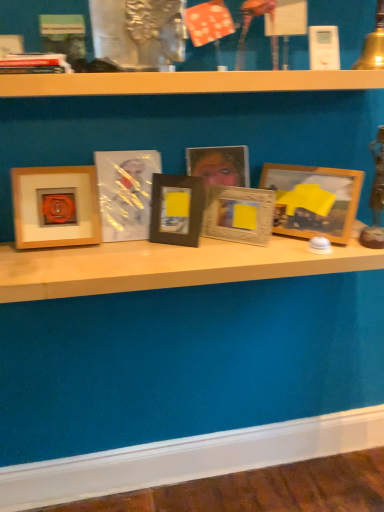
Image resolution: width=384 pixels, height=512 pixels. I want to click on black matte picture frame at center, which ranks as the third picture frame in left-to-right order, so click(x=176, y=209).

The width and height of the screenshot is (384, 512). What do you see at coordinates (176, 209) in the screenshot?
I see `black matte picture frame at center, which is the 4th picture frame in right-to-left order` at bounding box center [176, 209].

Identify the location of hardcover book at upper left. The image size is (384, 512). (34, 64).

This screenshot has height=512, width=384. What are the coordinates of `wooden shelf at upper center` in the screenshot? It's located at (186, 82).

In order to face wooden shelf at upper center, should I rotate leftwards or rightwards?

To face it directly, rotate right by 1.741 degrees.

You are a GUI agent. You are given a task and a screenshot of the screen. Output one action in this format:
    pyautogui.click(x=<x>, y=<y>)
    Task: Click on the wooden shelf at center
    The height and width of the screenshot is (512, 384).
    Given the screenshot: What is the action you would take?
    168,266

Image resolution: width=384 pixels, height=512 pixels. What do you see at coordinates (55, 207) in the screenshot? I see `matte wood picture frame at left, the sixth picture frame when ordered from right to left` at bounding box center [55, 207].

You are a GUI agent. You are given a task and a screenshot of the screen. Output one action in this format:
    pyautogui.click(x=<x>, y=<y>)
    Task: Click on the black matte picture frame at center, which ranks as the third picture frame in left-to-right order
    
    Given the screenshot: What is the action you would take?
    pyautogui.click(x=176, y=209)

Does matte wood picture frame at left, the sixth picture frame when ordered from right to left, have a greater width compared to hardcover book at upper left?

In fact, matte wood picture frame at left, the sixth picture frame when ordered from right to left, might be narrower than hardcover book at upper left.

Based on their sizes in the image, would you say matte wood picture frame at left, the sixth picture frame when ordered from right to left, is bigger or smaller than hardcover book at upper left?

In the image, matte wood picture frame at left, the sixth picture frame when ordered from right to left, appears to be larger than hardcover book at upper left.

Does matte wood picture frame at left, marked as the first picture frame in a left-to-right arrangement, lie behind hardcover book at upper left?

Yes, the depth of matte wood picture frame at left, marked as the first picture frame in a left-to-right arrangement, is greater than that of hardcover book at upper left.

Which object is positioned more to the left, matte wood picture frame at left, marked as the first picture frame in a left-to-right arrangement, or hardcover book at upper left?

hardcover book at upper left.

In terms of width, does matte plastic picture frame at center, the fifth picture frame from the right, look wider or thinner when compared to wooden shelf at center?

Clearly, matte plastic picture frame at center, the fifth picture frame from the right, has less width compared to wooden shelf at center.

Considering the positions of point (113, 188) and point (157, 259), is point (113, 188) closer or farther from the camera than point (157, 259)?

Point (113, 188) is positioned farther from the camera compared to point (157, 259).

From a real-world perspective, between matte plastic picture frame at center, marked as the 2th picture frame in a left-to-right arrangement, and wooden shelf at center, who is vertically higher?

matte plastic picture frame at center, marked as the 2th picture frame in a left-to-right arrangement, is physically above.

Is matte plastic picture frame at center, the fifth picture frame from the right, situated inside wooden shelf at center or outside?

matte plastic picture frame at center, the fifth picture frame from the right, is spatially situated outside wooden shelf at center.

Is matte plastic picture frame at center, marked as the 2th picture frame in a left-to-right arrangement, directly adjacent to wooden photo frame at center, acting as the fourth picture frame starting from the left?

matte plastic picture frame at center, marked as the 2th picture frame in a left-to-right arrangement, is not next to wooden photo frame at center, acting as the fourth picture frame starting from the left, and they're not touching.

Who is more distant, matte plastic picture frame at center, marked as the 2th picture frame in a left-to-right arrangement, or wooden photo frame at center, acting as the fourth picture frame starting from the left?

Positioned behind is wooden photo frame at center, acting as the fourth picture frame starting from the left.

Measure the distance between matte plastic picture frame at center, marked as the 2th picture frame in a left-to-right arrangement, and wooden photo frame at center, the 3th picture frame in the right-to-left sequence.

matte plastic picture frame at center, marked as the 2th picture frame in a left-to-right arrangement, is 23.09 centimeters from wooden photo frame at center, the 3th picture frame in the right-to-left sequence.

From the image's perspective, does matte plastic picture frame at center, marked as the 2th picture frame in a left-to-right arrangement, appear lower than wooden photo frame at center, acting as the fourth picture frame starting from the left?

Correct, matte plastic picture frame at center, marked as the 2th picture frame in a left-to-right arrangement, appears lower than wooden photo frame at center, acting as the fourth picture frame starting from the left, in the image.

Is wooden shelf at center positioned far away from wooden picture frame at center, the 2th picture frame when ordered from right to left?

No, wooden shelf at center is in close proximity to wooden picture frame at center, the 2th picture frame when ordered from right to left.

From a real-world perspective, who is located lower, wooden shelf at center or wooden picture frame at center, the 2th picture frame when ordered from right to left?

wooden shelf at center is physically lower.

Looking at this image, can you tell me how much wooden shelf at center and wooden picture frame at center, the fifth picture frame from the left, differ in facing direction?

The facing directions of wooden shelf at center and wooden picture frame at center, the fifth picture frame from the left, are 37 degrees apart.

Which object is positioned more to the right, wooden shelf at center or wooden picture frame at center, the 2th picture frame when ordered from right to left?

From the viewer's perspective, wooden picture frame at center, the 2th picture frame when ordered from right to left, appears more on the right side.

From a real-world perspective, is hardcover book at upper left positioned above or below wooden shelf at upper center?

Clearly, from a real-world perspective, hardcover book at upper left is above wooden shelf at upper center.

Is hardcover book at upper left to the left or to the right of wooden shelf at upper center in the image?

From the image, it's evident that hardcover book at upper left is to the left of wooden shelf at upper center.

Is hardcover book at upper left taller or shorter than wooden shelf at upper center?

Considering their sizes, hardcover book at upper left has less height than wooden shelf at upper center.

How different are the orientations of hardcover book at upper left and wooden shelf at upper center in degrees?

The angle between the facing direction of hardcover book at upper left and the facing direction of wooden shelf at upper center is 4.75 degrees.

Is wooden picture frame at center, the fifth picture frame from the left, wider or thinner than hardcover book at upper left?

In the image, wooden picture frame at center, the fifth picture frame from the left, appears to be more narrow than hardcover book at upper left.

Is wooden picture frame at center, the 2th picture frame when ordered from right to left, in contact with hardcover book at upper left?

wooden picture frame at center, the 2th picture frame when ordered from right to left, is not next to hardcover book at upper left, and they're not touching.

Which point is more distant from viewer, (251, 207) or (9, 68)?

Positioned behind is point (251, 207).

Is wooden picture frame at center, the 2th picture frame when ordered from right to left, further to camera compared to hardcover book at upper left?

Yes, it is.

How different are the orientations of matte plastic picture frame at center, the fifth picture frame from the right, and wooden picture frame at center, the fifth picture frame from the left, in degrees?

36.2 degrees.

In the scene shown: In terms of width, does matte plastic picture frame at center, the fifth picture frame from the right, look wider or thinner when compared to wooden picture frame at center, the 2th picture frame when ordered from right to left?

In the image, matte plastic picture frame at center, the fifth picture frame from the right, appears to be wider than wooden picture frame at center, the 2th picture frame when ordered from right to left.

Could wooden picture frame at center, the fifth picture frame from the left, be considered to be inside matte plastic picture frame at center, the fifth picture frame from the right?

No, wooden picture frame at center, the fifth picture frame from the left, is located outside of matte plastic picture frame at center, the fifth picture frame from the right.

Could you tell me if matte plastic picture frame at center, marked as the 2th picture frame in a left-to-right arrangement, is turned towards wooden picture frame at center, the fifth picture frame from the left?

No, matte plastic picture frame at center, marked as the 2th picture frame in a left-to-right arrangement, is not aimed at wooden picture frame at center, the fifth picture frame from the left.

Which picture frame is the 1st one when counting from the right side of the hardcover book at upper left? Please provide its 2D coordinates.

[(55, 207)]

Where is `picture frame that is the 5th one when counting upward from the wooden shelf at center (from the image's perspective)`? Image resolution: width=384 pixels, height=512 pixels. picture frame that is the 5th one when counting upward from the wooden shelf at center (from the image's perspective) is located at coordinates coord(126,192).

Estimate the real-world distances between objects in this image. Which object is closer to wooden shelf at upper center, hardcover book at upper left or wooden shelf at center?

hardcover book at upper left.

When comparing their distances from wooden picture frame at center, the 2th picture frame when ordered from right to left, does black matte picture frame at center, which ranks as the third picture frame in left-to-right order, or wooden photo frame at center, the 3th picture frame in the right-to-left sequence, seem closer?

Among the two, black matte picture frame at center, which ranks as the third picture frame in left-to-right order, is located nearer to wooden picture frame at center, the 2th picture frame when ordered from right to left.

Considering their positions, is hardcover book at upper left positioned closer to matte plastic picture frame at center, marked as the 2th picture frame in a left-to-right arrangement, than wooden picture frame at center, the 2th picture frame when ordered from right to left?

wooden picture frame at center, the 2th picture frame when ordered from right to left, lies closer to matte plastic picture frame at center, marked as the 2th picture frame in a left-to-right arrangement, than the other object.

Considering their positions, is wooden photo frame at center, the 3th picture frame in the right-to-left sequence, positioned further to wooden shelf at upper center than hardcover book at upper left?

wooden photo frame at center, the 3th picture frame in the right-to-left sequence, is positioned further to the anchor wooden shelf at upper center.

Which object lies further to the anchor point wooden shelf at upper center, black matte picture frame at center, which ranks as the third picture frame in left-to-right order, or wooden shelf at center?

Among the two, wooden shelf at center is located further to wooden shelf at upper center.

Which object lies nearer to the anchor point black matte picture frame at center, which ranks as the third picture frame in left-to-right order, wooden shelf at upper center or wooden picture frame at center, the 2th picture frame when ordered from right to left?

Based on the image, wooden picture frame at center, the 2th picture frame when ordered from right to left, appears to be nearer to black matte picture frame at center, which ranks as the third picture frame in left-to-right order.

Consider the image. Based on their spatial positions, is hardcover book at upper left or wooden shelf at upper center further from black matte picture frame at center, which is the 4th picture frame in right-to-left order?

hardcover book at upper left.

Which object lies nearer to the anchor point wooden shelf at upper center, wooden picture frame at center, the 2th picture frame when ordered from right to left, or matte wood picture frame at left, marked as the first picture frame in a left-to-right arrangement?

wooden picture frame at center, the 2th picture frame when ordered from right to left.

Locate an element on the screen. Image resolution: width=384 pixels, height=512 pixels. table between matte wood picture frame at left, marked as the first picture frame in a left-to-right arrangement, and wooden shelf at upper center, in the horizontal direction is located at coordinates (168, 266).

You are a GUI agent. You are given a task and a screenshot of the screen. Output one action in this format:
    pyautogui.click(x=<x>, y=<y>)
    Task: Click on the shelf between hardcover book at upper left and wooden photo frame at center, acting as the fourth picture frame starting from the left, from left to right
    The image size is (384, 512).
    Given the screenshot: What is the action you would take?
    pyautogui.click(x=186, y=82)

Find the location of a particular element. This screenshot has height=512, width=384. shelf between hardcover book at upper left and wooden shelf at center from top to bottom is located at coordinates (186, 82).

Where is `table located between hardcover book at upper left and wooden picture frame at center, the fifth picture frame from the left, in the left-right direction`? The width and height of the screenshot is (384, 512). table located between hardcover book at upper left and wooden picture frame at center, the fifth picture frame from the left, in the left-right direction is located at coordinates (168, 266).